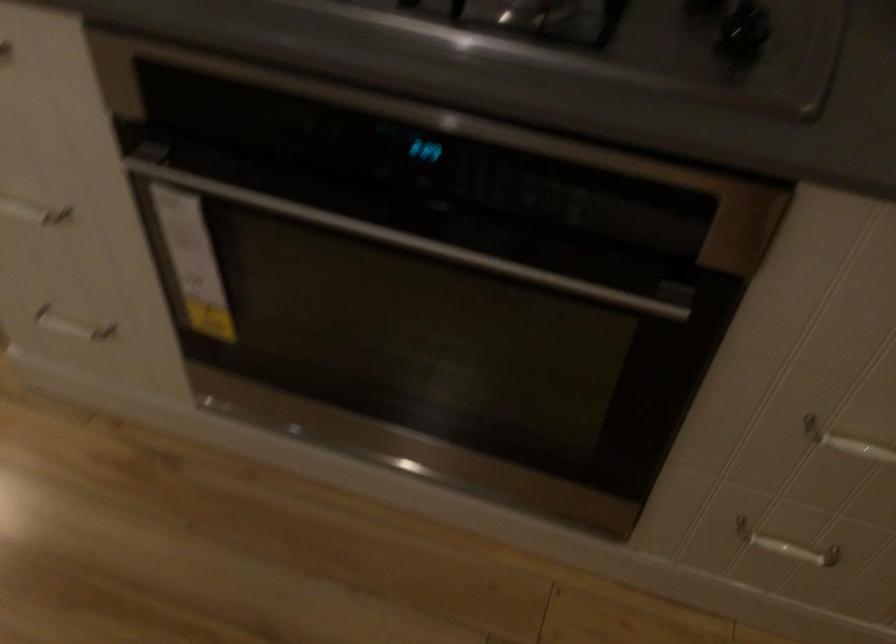
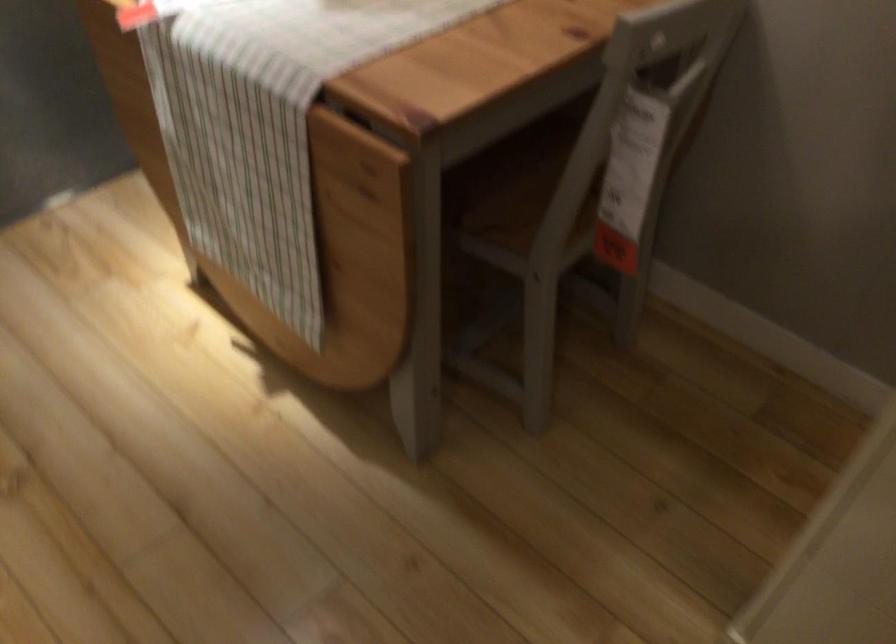
The images are taken continuously from a first-person perspective. In which direction are you moving?

The cameraman walked toward left, forward.